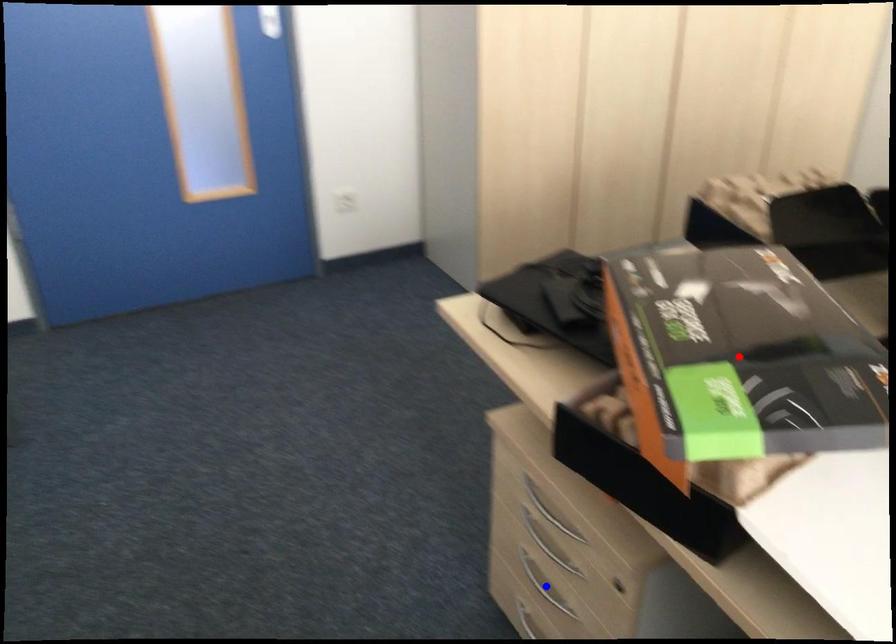
Question: Which of the two points in the image is closer to the camera?

Choices:
 (A) Blue point is closer.
 (B) Red point is closer.

Answer: (B)